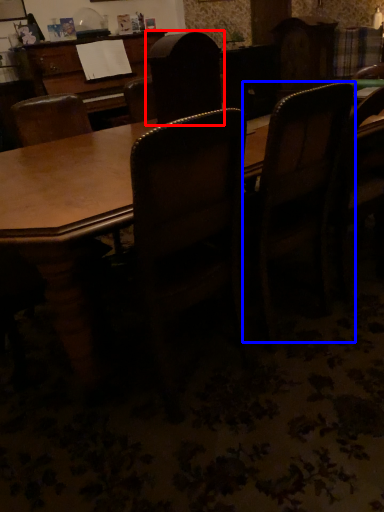
Question: Which point is further to the camera, chair (highlighted by a red box) or chair (highlighted by a blue box)?

Choices:
 (A) chair
 (B) chair

Answer: (A)